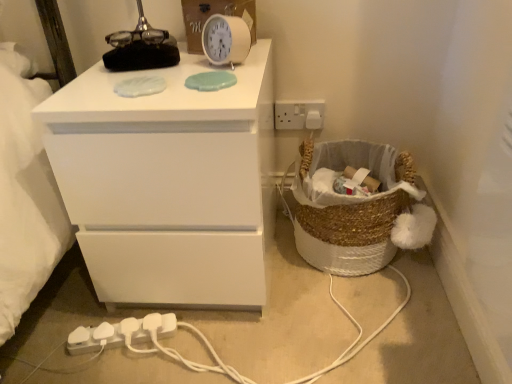
Where is `white plastic clock at upper center`? The width and height of the screenshot is (512, 384). white plastic clock at upper center is located at coordinates (226, 40).

Find the location of a particular element. Image resolution: width=512 pixels, height=384 pixels. white plastic extension cord at lower left is located at coordinates (121, 333).

Image resolution: width=512 pixels, height=384 pixels. I want to click on white plastic clock at upper center, so click(226, 40).

Does white plastic extension cord at lower left have a lesser height compared to white matte chest of drawers at upper left?

Yes, white plastic extension cord at lower left is shorter than white matte chest of drawers at upper left.

Which object is thinner, white plastic extension cord at lower left or white matte chest of drawers at upper left?

white plastic extension cord at lower left is thinner.

In the scene shown: From the image's perspective, does white plastic extension cord at lower left appear lower than white matte chest of drawers at upper left?

Yes, from the image's perspective, white plastic extension cord at lower left is below white matte chest of drawers at upper left.

Is white plastic extension cord at lower left closer to the viewer compared to white matte chest of drawers at upper left?

No, it is not.

How different are the orientations of white matte chest of drawers at upper left and braided wicker basket at lower right in degrees?

2.73 degrees.

Between white matte chest of drawers at upper left and braided wicker basket at lower right, which one appears on the left side from the viewer's perspective?

Positioned to the left is white matte chest of drawers at upper left.

From a real-world perspective, is white matte chest of drawers at upper left beneath braided wicker basket at lower right?

No, from a real-world perspective, white matte chest of drawers at upper left is not under braided wicker basket at lower right.

Which is nearer, (x=280, y=123) or (x=91, y=331)?

Point (x=280, y=123).

Considering the relative sizes of white plastic electrical outlet at upper right and white plastic extension cord at lower left in the image provided, is white plastic electrical outlet at upper right shorter than white plastic extension cord at lower left?

No.

In the scene shown: Between white plastic electrical outlet at upper right and white plastic extension cord at lower left, which one has smaller size?

white plastic electrical outlet at upper right is smaller.

Is white plastic electrical outlet at upper right in front of white plastic extension cord at lower left?

No, white plastic electrical outlet at upper right is behind white plastic extension cord at lower left.

From a real-world perspective, is braided wicker basket at lower right below white plastic extension cord at lower left?

Actually, braided wicker basket at lower right is physically above white plastic extension cord at lower left in the real world.

From the image's perspective, does braided wicker basket at lower right appear higher than white plastic extension cord at lower left?

Yes, from the image's perspective, braided wicker basket at lower right is over white plastic extension cord at lower left.

Is white plastic clock at upper center inside the boundaries of white matte chest of drawers at upper left, or outside?

white plastic clock at upper center is spatially situated outside white matte chest of drawers at upper left.

Find the location of a particular element. clock that appears above the white matte chest of drawers at upper left (from a real-world perspective) is located at coordinates (226, 40).

From the picture: Can you confirm if white plastic clock at upper center is taller than white matte chest of drawers at upper left?

No.

Is point (240, 59) farther from viewer compared to point (219, 242)?

Yes, point (240, 59) is farther from viewer.

Considering the relative sizes of white plastic extension cord at lower left and braided wicker basket at lower right in the image provided, is white plastic extension cord at lower left wider than braided wicker basket at lower right?

No, white plastic extension cord at lower left is not wider than braided wicker basket at lower right.

Which of these two, white plastic extension cord at lower left or braided wicker basket at lower right, is smaller?

Smaller between the two is white plastic extension cord at lower left.

Locate an element on the screen. basket lying above the white plastic extension cord at lower left (from the image's perspective) is located at coordinates (351, 209).

Based on the photo, from a real-world perspective, which object rests below the other?

white plastic extension cord at lower left, from a real-world perspective.

Is white plastic electrical outlet at upper right wider or thinner than braided wicker basket at lower right?

Considering their sizes, white plastic electrical outlet at upper right looks slimmer than braided wicker basket at lower right.

Considering the points (295, 116) and (362, 252), which point is behind, point (295, 116) or point (362, 252)?

The point (295, 116) is behind.

Find the location of `basket located below the white plastic electrical outlet at upper right (from the image's perspective)`. basket located below the white plastic electrical outlet at upper right (from the image's perspective) is located at coordinates point(351,209).

Can you tell me how much white plastic electrical outlet at upper right and braided wicker basket at lower right differ in facing direction?

There is a 1.58-degree angle between the facing directions of white plastic electrical outlet at upper right and braided wicker basket at lower right.

I want to click on the chest of drawers in front of the white plastic extension cord at lower left, so click(x=169, y=183).

This screenshot has height=384, width=512. In the image, there is a braided wicker basket at lower right. In order to click on the chest of drawers above it (from the image's perspective) in this screenshot , I will do `click(169, 183)`.

From the image, which object appears to be farther from white plastic clock at upper center, braided wicker basket at lower right or white matte chest of drawers at upper left?

The object further to white plastic clock at upper center is braided wicker basket at lower right.

Based on their spatial positions, is white plastic extension cord at lower left or braided wicker basket at lower right closer to white plastic clock at upper center?

braided wicker basket at lower right is positioned closer to the anchor white plastic clock at upper center.

Looking at the image, which one is located closer to braided wicker basket at lower right, white plastic clock at upper center or white plastic electrical outlet at upper right?

Among the two, white plastic electrical outlet at upper right is located nearer to braided wicker basket at lower right.

Estimate the real-world distances between objects in this image. Which object is further from white matte chest of drawers at upper left, white plastic electrical outlet at upper right or white plastic extension cord at lower left?

white plastic electrical outlet at upper right.

Looking at the image, which one is located further to white plastic extension cord at lower left, braided wicker basket at lower right or white matte chest of drawers at upper left?

braided wicker basket at lower right lies further to white plastic extension cord at lower left than the other object.

Looking at the image, which one is located closer to white plastic electrical outlet at upper right, white matte chest of drawers at upper left or white plastic extension cord at lower left?

white matte chest of drawers at upper left is closer to white plastic electrical outlet at upper right.

Looking at the image, which one is located closer to braided wicker basket at lower right, white plastic extension cord at lower left or white plastic clock at upper center?

Based on the image, white plastic clock at upper center appears to be nearer to braided wicker basket at lower right.

When comparing their distances from braided wicker basket at lower right, does white plastic clock at upper center or white plastic extension cord at lower left seem further?

Among the two, white plastic extension cord at lower left is located further to braided wicker basket at lower right.

Image resolution: width=512 pixels, height=384 pixels. What are the coordinates of `clock situated between white matte chest of drawers at upper left and braided wicker basket at lower right from left to right` in the screenshot? It's located at (226, 40).

Where is `the chest of drawers between white plastic electrical outlet at upper right and white plastic extension cord at lower left vertically`? the chest of drawers between white plastic electrical outlet at upper right and white plastic extension cord at lower left vertically is located at coordinates (169, 183).

Locate an element on the screen. basket between white matte chest of drawers at upper left and white plastic electrical outlet at upper right in the front-back direction is located at coordinates [351, 209].

Image resolution: width=512 pixels, height=384 pixels. In order to click on clock between white matte chest of drawers at upper left and white plastic electrical outlet at upper right from front to back in this screenshot , I will do `click(226, 40)`.